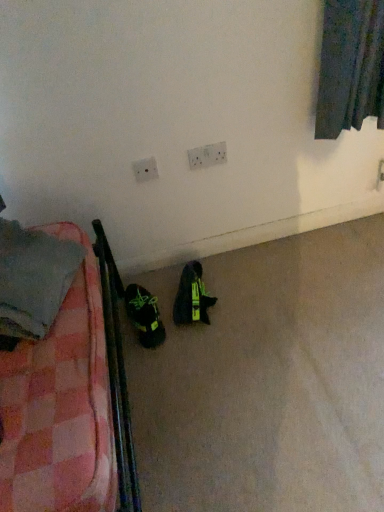
At what (x,y) coordinates should I click in order to perform the action: click on free spot in front of green synthetic shoe at center, which ranks as the first footwear in right-to-left order. Please return your answer as a coordinate pair (x, y). Looking at the image, I should click on (195, 342).